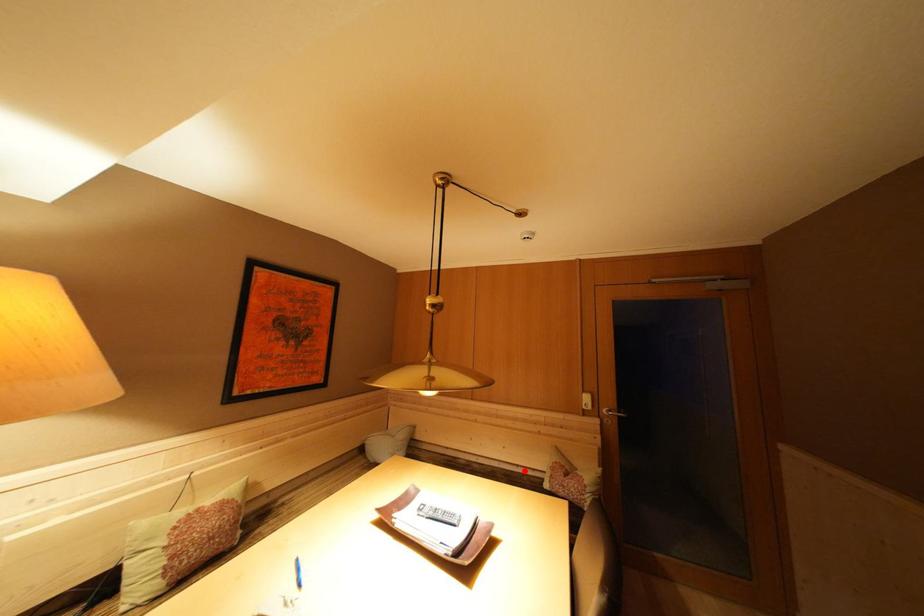
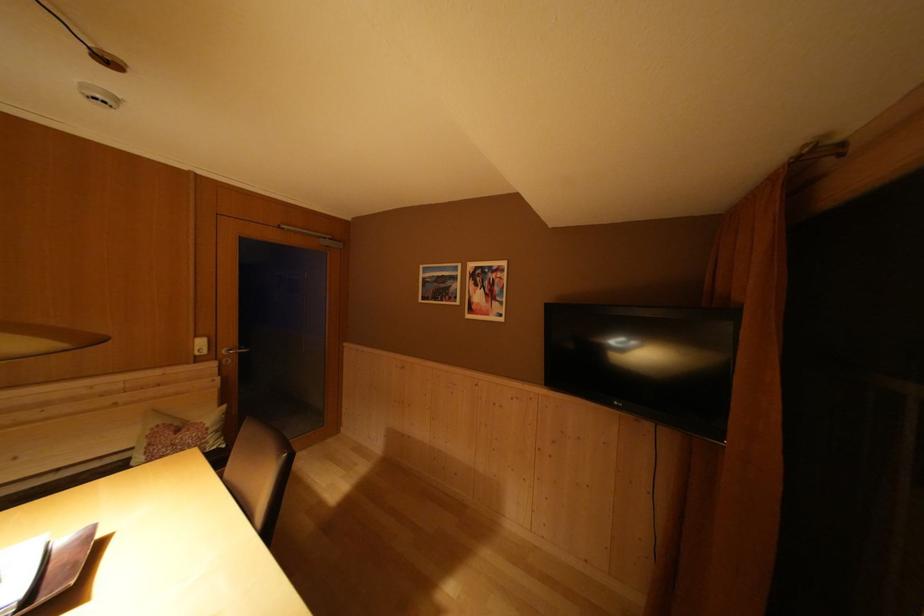
Locate, in the second image, the point that corresponds to the highlighted location in the first image.

(66, 475)